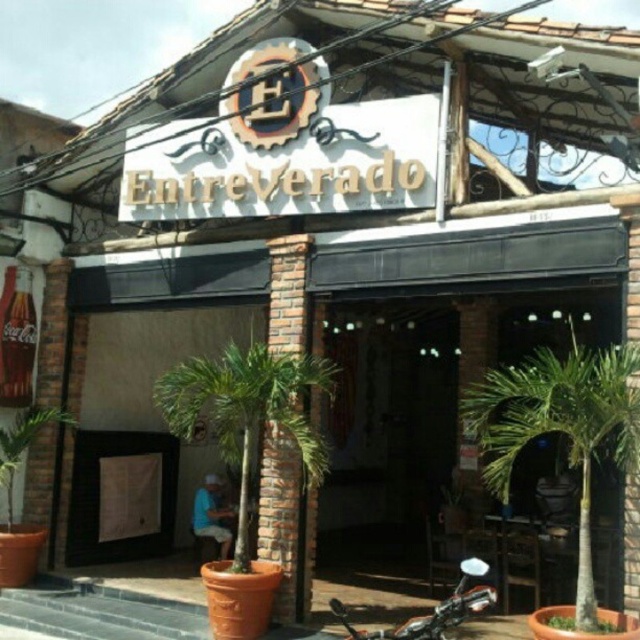
The height and width of the screenshot is (640, 640). What do you see at coordinates (248, 412) in the screenshot?
I see `green leafy palm tree at center` at bounding box center [248, 412].

Can you confirm if green leafy palm tree at center is bigger than shiny chrome motorcycle at lower center?

Yes.

Which is behind, point (237, 387) or point (397, 637)?

Point (237, 387)

Where is `green leafy palm tree at center`? Image resolution: width=640 pixels, height=640 pixels. green leafy palm tree at center is located at coordinates (248, 412).

Who is more distant from viewer, (509, 454) or (436, 612)?

The point (509, 454) is more distant.

This screenshot has height=640, width=640. What are the coordinates of `green leafy palm tree at right` in the screenshot? It's located at (561, 428).

Does point (536, 376) lie in front of point (452, 593)?

That is True.

Find the location of a particular element. green leafy palm tree at right is located at coordinates (561, 428).

Is point (588, 556) behind point (221, 403)?

No, it is in front of (221, 403).

Where is `green leafy palm tree at right`? green leafy palm tree at right is located at coordinates (561, 428).